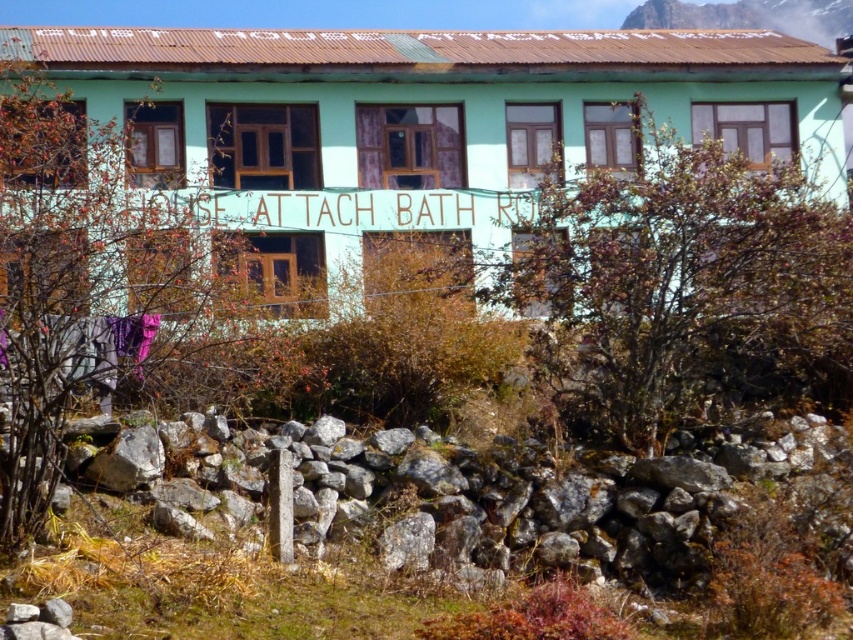
You are a painter who needs to paint the gray rock wall at lower center and the rugged brown rock at upper center. If you have enough paint to cover 10 square meters, which rock structure will you be able to paint completely?

The gray rock wall at lower center has a lesser width compared to rugged brown rock at upper center, so the gray rock wall at lower center requires less paint and can be painted completely with the available 10 square meters of paint.

You are standing in front of the building and want to place a small potted plant between the gray rock wall at lower center and the rugged brown rock at upper center. Based on their positions, where should you place the potted plant?

You should place the potted plant between the gray rock wall at lower center and the rugged brown rock at upper center since the gray rock wall is positioned under the rugged brown rock, creating a vertical space between them.